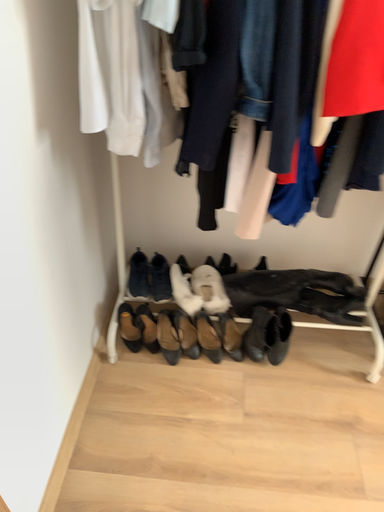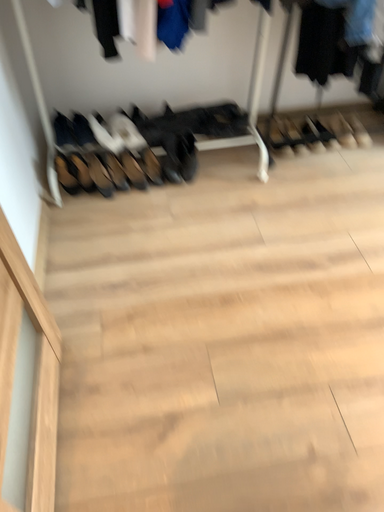
Question: How did the camera likely rotate when shooting the video?

Choices:
 (A) rotated downward
 (B) rotated upward

Answer: (A)